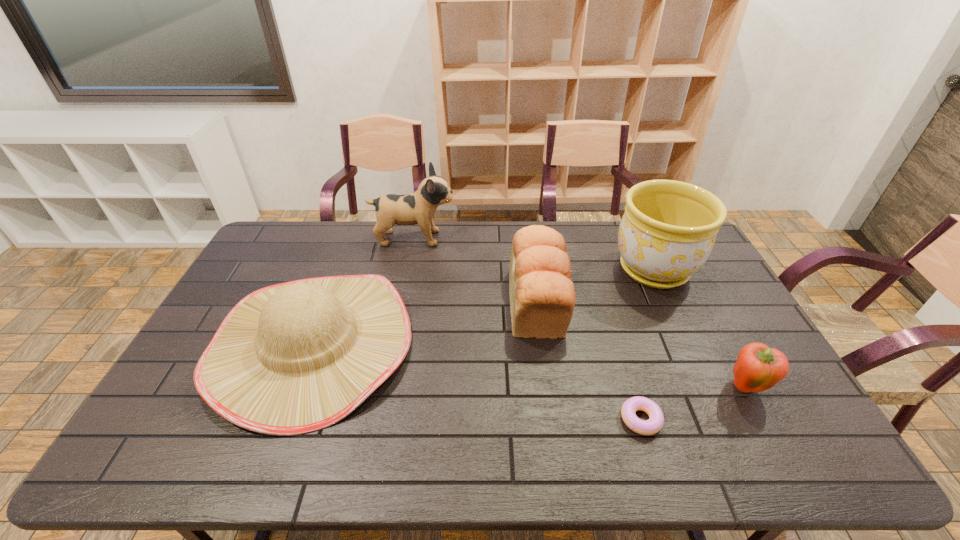
The image size is (960, 540). In order to click on puppy in this screenshot , I will do `click(419, 208)`.

Locate an element on the screen. Image resolution: width=960 pixels, height=540 pixels. flowerpot is located at coordinates (668, 230).

At what (x,y) coordinates should I click in order to perform the action: click on the fourth object from right to left. Please return your answer as a coordinate pair (x, y). This screenshot has height=540, width=960. Looking at the image, I should click on click(542, 297).

Identify the location of sunhat. The image size is (960, 540). (293, 358).

Where is `pepper`? Image resolution: width=960 pixels, height=540 pixels. pepper is located at coordinates (758, 368).

This screenshot has height=540, width=960. Identify the location of the fourth object from left to right. (656, 418).

Image resolution: width=960 pixels, height=540 pixels. I want to click on doughnut, so click(656, 418).

Find the location of a particular element. Image resolution: width=960 pixels, height=540 pixels. vacant space located at the face of the puppy is located at coordinates (528, 238).

The image size is (960, 540). What are the coordinates of `vacant space located on the left of the flowerpot` in the screenshot? It's located at (513, 269).

Locate an element on the screen. blank space located 0.370m on the left of the bread is located at coordinates (396, 302).